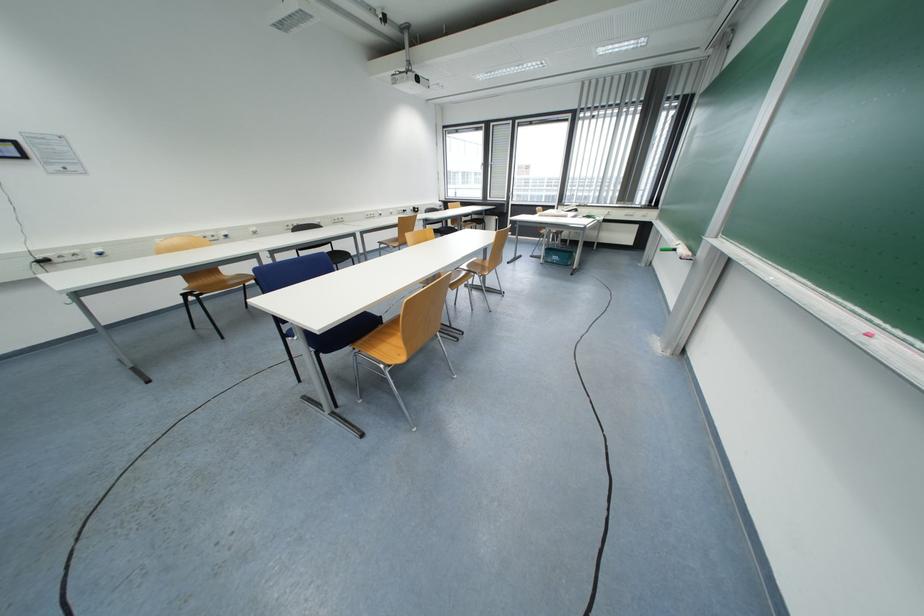
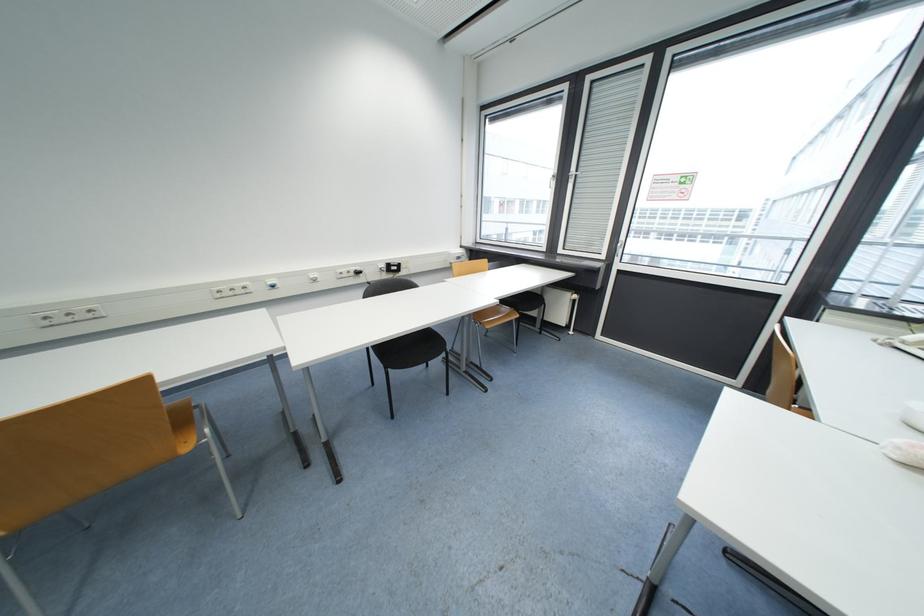
Question: The images are taken continuously from a first-person perspective. In which direction are you moving?

Choices:
 (A) Left
 (B) Right
 (C) Forward
 (D) Backward

Answer: (C)